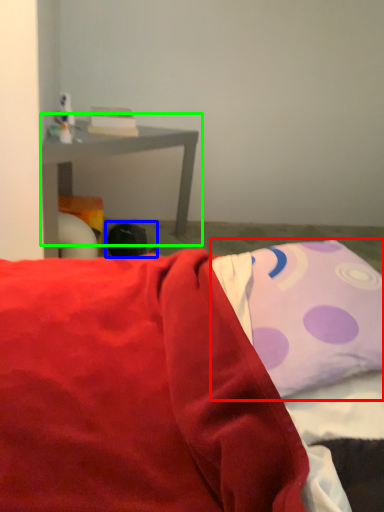
Question: Based on their relative distances, which object is nearer to pillow (highlighted by a red box)? Choose from bean bag chair (highlighted by a blue box) and table (highlighted by a green box).

Choices:
 (A) bean bag chair
 (B) table

Answer: (A)